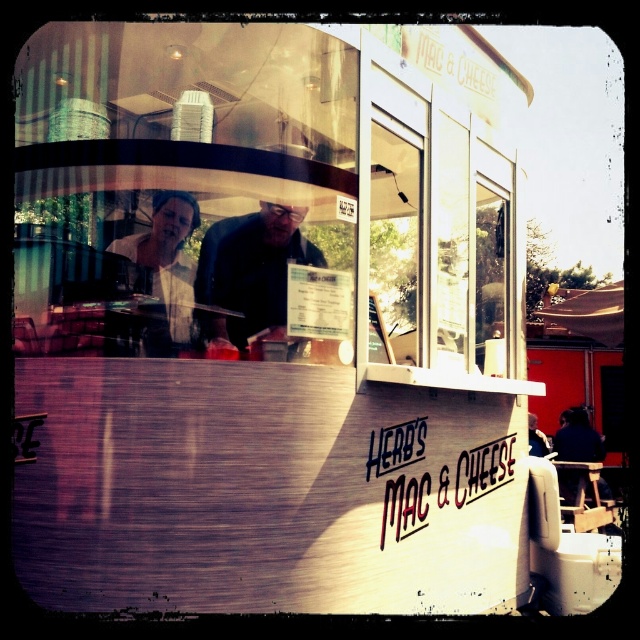
You are a customer at Herb s Mac Cheese food truck and you notice two items inside the truck. One is a dark brown leather jacket at center and the other is a matte white shirt at upper left. From your perspective outside the truck, which item is positioned more to the right?

The dark brown leather jacket at center is positioned more to the right compared to the matte white shirt at upper left.

You are standing outside the food truck and see the dark brown leather jacket at center. If you want to touch the jacket, should you reach towards the center of the window?

Yes, because the dark brown leather jacket at center is located at the center of the window according to its 2D coordinates.

You are standing outside the food truck and looking through the window. There are two points marked on the window. The first point is at coordinate (208, 243) and the second point is at (176, 269). Which point is closer to you as you look through the window?

The point at coordinate (208, 243) is closer to you because it is further to the viewer than the other point.